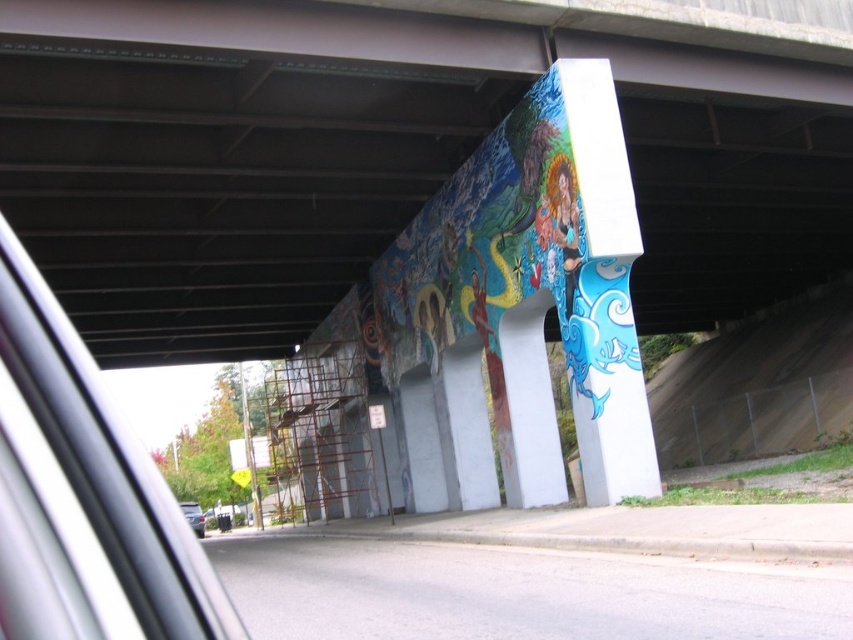
Question: Which object is the farthest from the white concrete pillar at center?

Choices:
 (A) gray asphalt highway at lower center
 (B) painted mural at center
 (C) transparent glass car window at left
 (D) metallic silver car at lower left

Answer: (D)

Question: In this image, where is painted mural at center located relative to gray asphalt highway at lower center?

Choices:
 (A) left
 (B) right

Answer: (B)

Question: In this image, where is gray asphalt highway at lower center located relative to metallic silver car at lower left?

Choices:
 (A) right
 (B) left

Answer: (A)

Question: Which of the following is the closest to the observer?

Choices:
 (A) tap(538, 397)
 (B) tap(126, 484)
 (C) tap(508, 628)

Answer: (B)

Question: Which of the following is the farthest from the observer?

Choices:
 (A) (201, 532)
 (B) (279, 17)
 (C) (444, 563)
 (D) (531, 504)

Answer: (A)

Question: Does gray asphalt highway at lower center lie in front of metallic silver car at lower left?

Choices:
 (A) yes
 (B) no

Answer: (A)